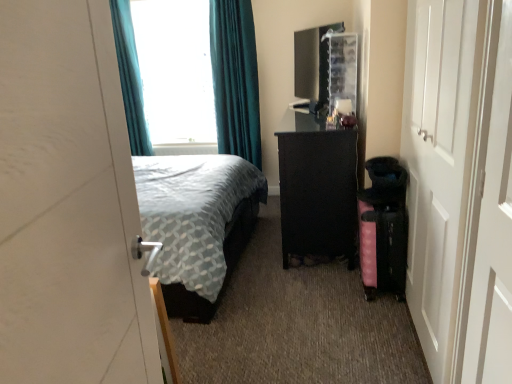
Question: In the image, is pink fabric suitcase at lower right positioned in front of or behind teal fabric curtain at upper center, the 1th curtain in the right-to-left sequence?

Choices:
 (A) front
 (B) behind

Answer: (A)

Question: Is pink fabric suitcase at lower right bigger or smaller than teal fabric curtain at upper center, the 1th curtain in the right-to-left sequence?

Choices:
 (A) big
 (B) small

Answer: (B)

Question: Estimate the real-world distances between objects in this image. Which object is farther from the white matte door at left, marked as the second door in a back-to-front arrangement?

Choices:
 (A) white wooden door at right, the 2th door positioned from the front
 (B) teal fabric curtain at upper center, the 2th curtain in the left-to-right sequence
 (C) teal fabric curtain at upper left, the 2th curtain from the right
 (D) teal fabric curtain at upper left
 (E) black textured dresser at center

Answer: (D)

Question: Which object is positioned farthest from the teal fabric curtain at upper left, positioned as the 1th curtain in left-to-right order?

Choices:
 (A) teal fabric curtain at upper left
 (B) teal fabric curtain at upper center, the 1th curtain in the right-to-left sequence
 (C) white wooden door at right, the first door from the right
 (D) pink fabric suitcase at lower right
 (E) black glossy file cabinet at upper center

Answer: (C)